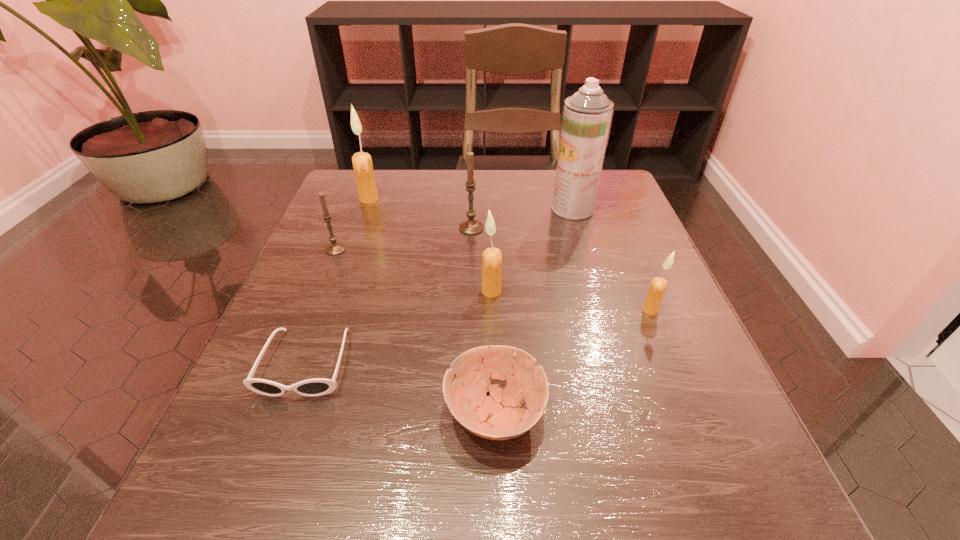
Identify the location of vacant position located on the back of the rightmost cream candle. (614, 222).

The height and width of the screenshot is (540, 960). In order to click on vacant space located on the right of the fourth farthest object in this screenshot , I will do `click(482, 249)`.

I want to click on vacant space located on the back of the brown bowl, so click(x=491, y=267).

Locate an element on the screen. This screenshot has width=960, height=540. aerosol can present at the far edge is located at coordinates (587, 114).

Locate an element on the screen. sunglasses that is at the left edge is located at coordinates (315, 387).

The image size is (960, 540). I want to click on aerosol can that is at the right edge, so click(587, 114).

Find the location of `candle that is at the right edge`. candle that is at the right edge is located at coordinates [657, 288].

Identify the location of object located in the far left corner section of the desktop. This screenshot has height=540, width=960. (362, 163).

This screenshot has height=540, width=960. Identify the location of object positioned at the far right corner. (587, 114).

I want to click on vacant space at the far edge of the desktop, so click(496, 203).